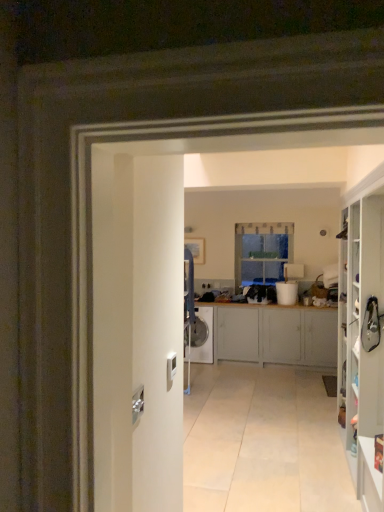
Question: From a real-world perspective, is white glossy washing machine at center below matte gray cabinet at center, positioned as the 2th cabinetry in front-to-back order?

Choices:
 (A) yes
 (B) no

Answer: (A)

Question: Can you confirm if white glossy washing machine at center is thinner than matte gray cabinet at center, which is counted as the 1th cabinetry, starting from the back?

Choices:
 (A) no
 (B) yes

Answer: (B)

Question: Is the surface of white glossy washing machine at center in direct contact with matte gray cabinet at center, which is counted as the 1th cabinetry, starting from the back?

Choices:
 (A) yes
 (B) no

Answer: (B)

Question: Is white glossy washing machine at center facing away from matte gray cabinet at center, which is counted as the 1th cabinetry, starting from the back?

Choices:
 (A) yes
 (B) no

Answer: (A)

Question: Can you confirm if white glossy washing machine at center is smaller than matte gray cabinet at center, positioned as the 2th cabinetry in front-to-back order?

Choices:
 (A) yes
 (B) no

Answer: (A)

Question: Is white glossy washing machine at center positioned in front of matte gray cabinet at center, which is counted as the 1th cabinetry, starting from the back?

Choices:
 (A) no
 (B) yes

Answer: (A)

Question: Is white glossy cabinet at right, the second cabinetry viewed from the back, completely or partially outside of white glossy washing machine at center?

Choices:
 (A) yes
 (B) no

Answer: (A)

Question: Could you tell me if white glossy cabinet at right, which is the first cabinetry in front-to-back order, is facing white glossy washing machine at center?

Choices:
 (A) yes
 (B) no

Answer: (B)

Question: Is white glossy cabinet at right, the second cabinetry viewed from the back, positioned in front of white glossy washing machine at center?

Choices:
 (A) yes
 (B) no

Answer: (A)

Question: From the image's perspective, does white glossy cabinet at right, which is the first cabinetry in front-to-back order, appear lower than white glossy washing machine at center?

Choices:
 (A) no
 (B) yes

Answer: (A)

Question: Is white glossy cabinet at right, the second cabinetry viewed from the back, taller than white glossy washing machine at center?

Choices:
 (A) yes
 (B) no

Answer: (A)

Question: Is white glossy cabinet at right, which is the first cabinetry in front-to-back order, not close to white glossy washing machine at center?

Choices:
 (A) no
 (B) yes

Answer: (B)

Question: Is white glossy washing machine at center located outside clear glass window at center?

Choices:
 (A) no
 (B) yes

Answer: (B)